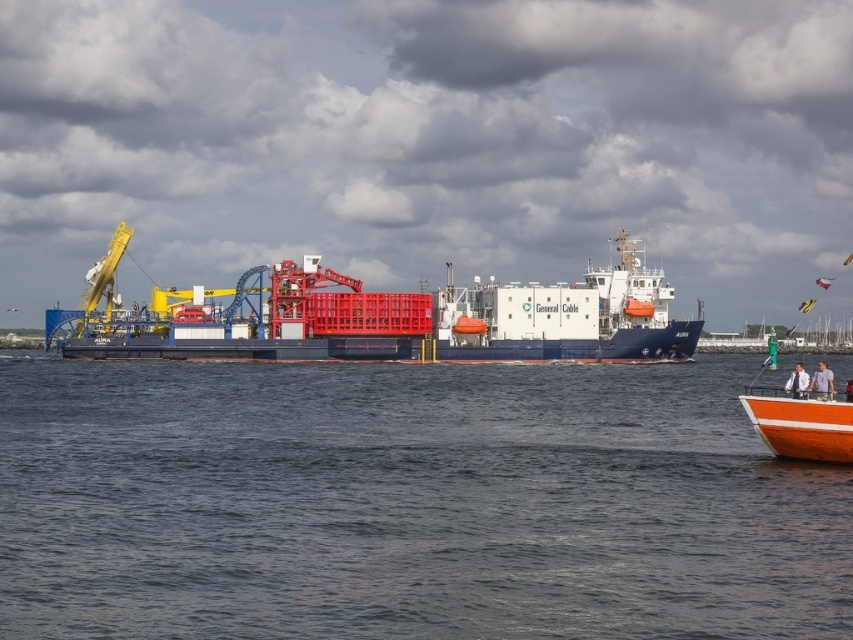
Question: Does dark blue water at center have a smaller size compared to blue matte cargo ship at center?

Choices:
 (A) no
 (B) yes

Answer: (B)

Question: Among these points, which one is nearest to the camera?

Choices:
 (A) (276, 476)
 (B) (508, 305)

Answer: (A)

Question: Does dark blue water at center have a larger size compared to blue matte cargo ship at center?

Choices:
 (A) no
 (B) yes

Answer: (A)

Question: Which object appears farthest from the camera in this image?

Choices:
 (A) blue matte cargo ship at center
 (B) dark blue water at center

Answer: (A)

Question: Is dark blue water at center smaller than blue matte cargo ship at center?

Choices:
 (A) no
 (B) yes

Answer: (B)